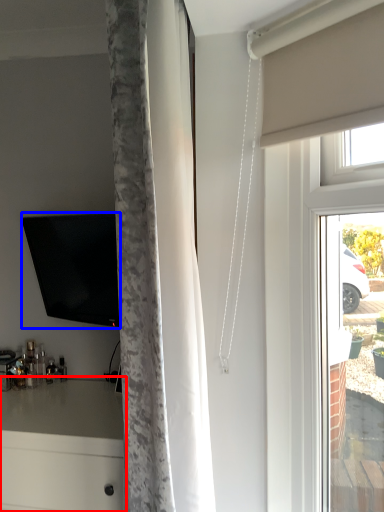
Question: Among these objects, which one is farthest to the camera, counter (highlighted by a red box) or television (highlighted by a blue box)?

Choices:
 (A) counter
 (B) television

Answer: (B)